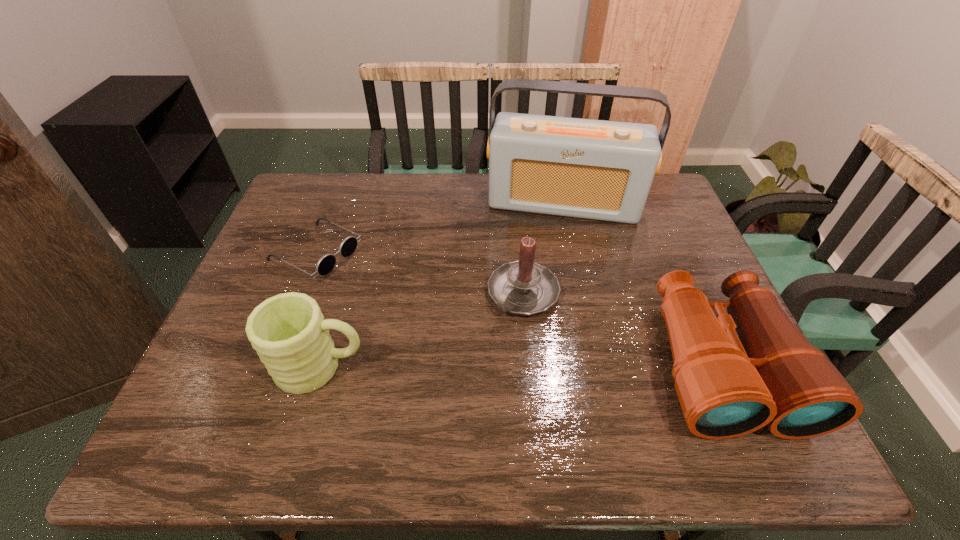
Where is `blank area located on the front-facing side of the tallest object`? The height and width of the screenshot is (540, 960). blank area located on the front-facing side of the tallest object is located at coordinates (547, 284).

Where is `vacant space located 0.380m on the front-facing side of the tallest object`? This screenshot has width=960, height=540. vacant space located 0.380m on the front-facing side of the tallest object is located at coordinates (542, 325).

This screenshot has width=960, height=540. I want to click on free location located 0.230m on the side of the candle with the handle loop, so click(x=446, y=387).

Where is `vacant point located 0.210m on the side of the candle with the handle loop`? This screenshot has width=960, height=540. vacant point located 0.210m on the side of the candle with the handle loop is located at coordinates (452, 380).

Where is `free point located 0.060m on the side of the candle with the handle loop`? free point located 0.060m on the side of the candle with the handle loop is located at coordinates (491, 334).

Where is `object that is at the far edge`? This screenshot has height=540, width=960. object that is at the far edge is located at coordinates (602, 170).

Where is `mug at the near edge`? mug at the near edge is located at coordinates (288, 331).

Where is `binoculars present at the near edge`? The height and width of the screenshot is (540, 960). binoculars present at the near edge is located at coordinates (728, 386).

Image resolution: width=960 pixels, height=540 pixels. Identify the location of mug situated at the left edge. (288, 331).

This screenshot has height=540, width=960. Identify the location of sunglasses that is at the left edge. (327, 262).